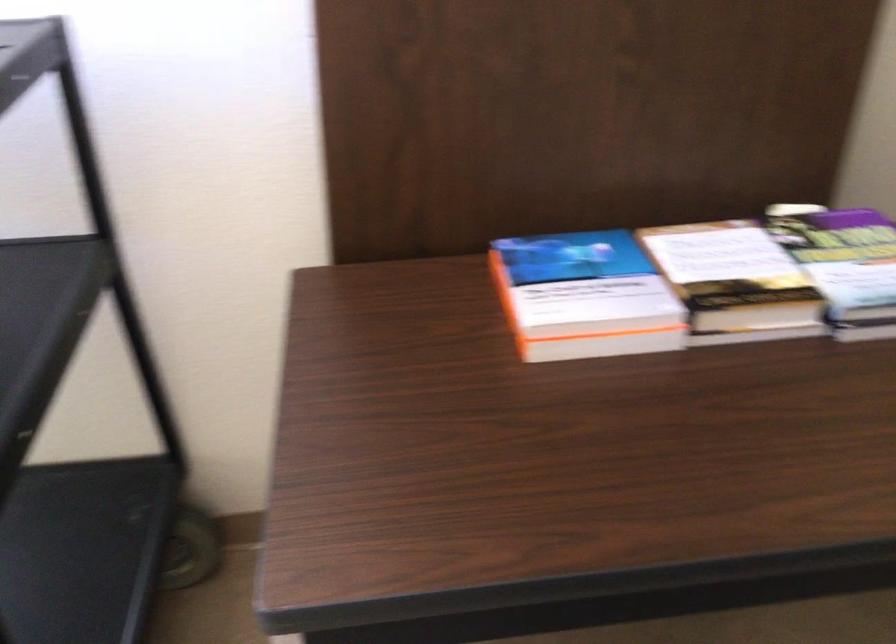
Locate an element on the screen. The height and width of the screenshot is (644, 896). white and gold book is located at coordinates (735, 281).